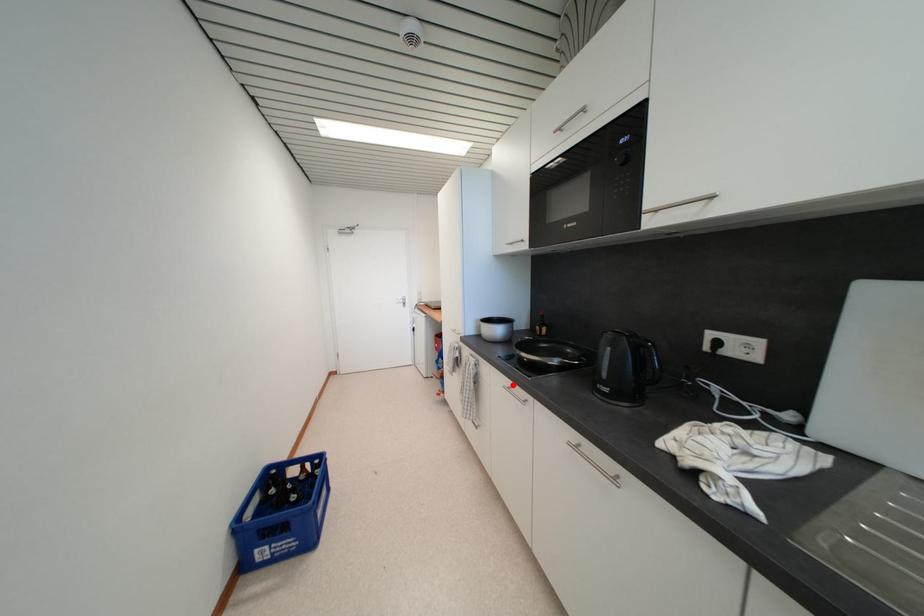
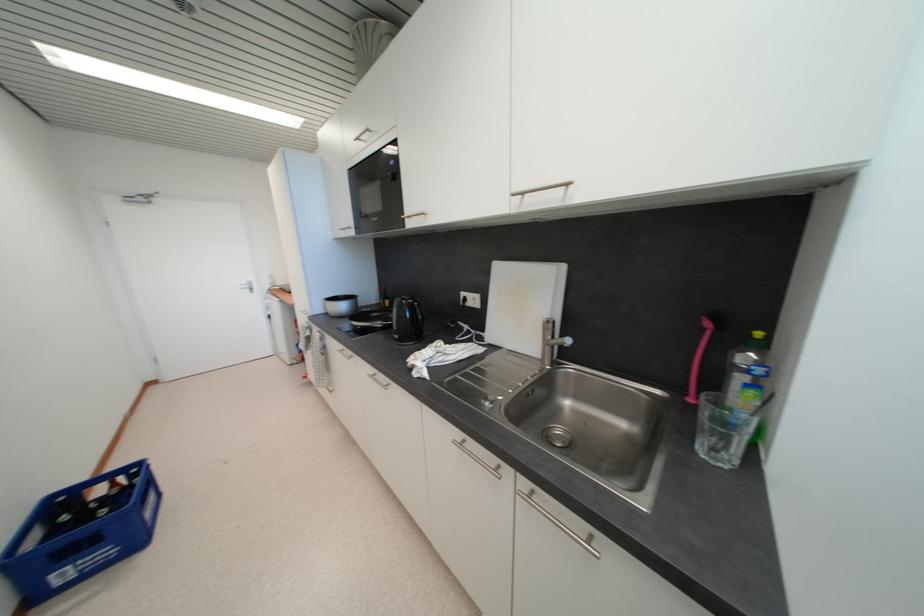
Question: I am providing you with two images of the same scene from different viewpoints. A red point is shown in image1. For the corresponding object point in image2, is it positioned nearer or farther from the camera?

Choices:
 (A) Nearer
 (B) Farther

Answer: (B)